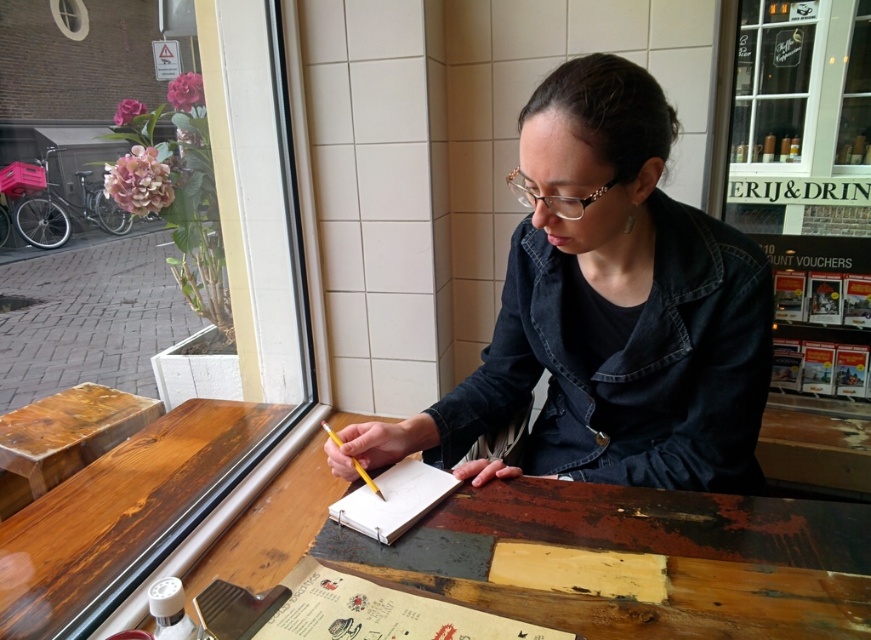
Who is shorter, clear glass window at upper right or wooden table at center?

Standing shorter between the two is wooden table at center.

Who is higher up, clear glass window at upper right or wooden table at center?

clear glass window at upper right is above.

Describe the element at coordinates (801, 118) in the screenshot. The width and height of the screenshot is (871, 640). I see `clear glass window at upper right` at that location.

I want to click on clear glass window at upper right, so click(801, 118).

Is clear glass window at upper right wider than white paper notebook at center?

Yes.

Between clear glass window at upper right and white paper notebook at center, which one is positioned higher?

clear glass window at upper right

Is point (804, 122) behind point (383, 513)?

Yes, it is.

Where is `clear glass window at upper right`? This screenshot has height=640, width=871. clear glass window at upper right is located at coordinates 801,118.

Can you confirm if denim jacket at center is bigger than clear glass window at upper right?

Yes.

Can you confirm if denim jacket at center is positioned to the right of clear glass window at upper right?

No, denim jacket at center is not to the right of clear glass window at upper right.

Does point (717, 310) lie behind point (795, 230)?

No, it is in front of (795, 230).

Where is `denim jacket at center`? This screenshot has height=640, width=871. denim jacket at center is located at coordinates (629, 364).